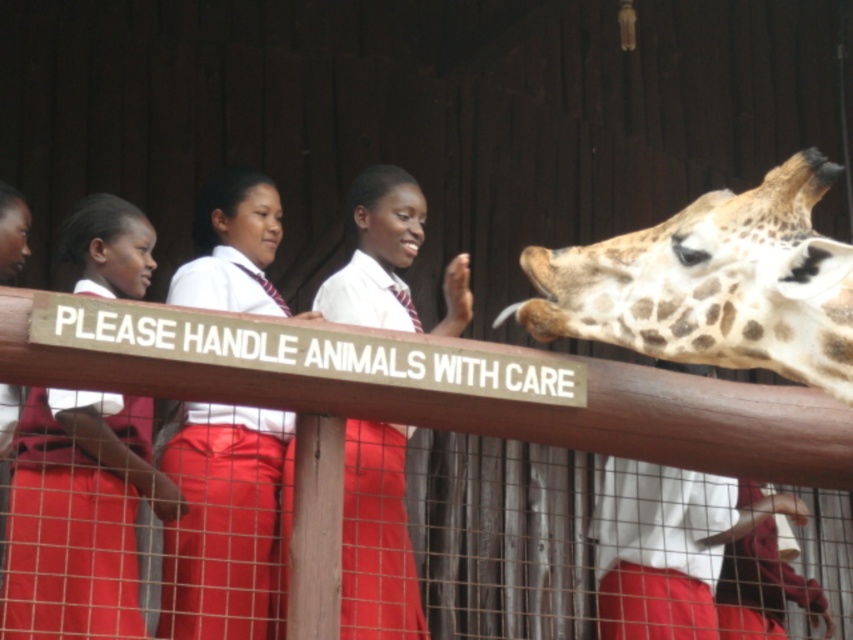
You are a photographer standing at the camera position. You want to take a photo of the spotted fur giraffe at right. The zoo requires that you must stay at least 20 meters away from the giraffe for safety. Is your current position compliant with the zoo rules?

The spotted fur giraffe at right is 25.92 meters from camera, which is more than the required 20 meters. Therefore, your current position complies with the zoo rules.

You are a zookeeper who needs to place a sign indicating the height of the spotted fur giraffe at right. The sign must be placed at the same height as the top of the matte red uniform at center. Will the sign be placed higher or lower than the giraffe?

The spotted fur giraffe at right is smaller than the matte red uniform at center, so the sign placed at the height of the matte red uniform at center will be higher than the giraffe.